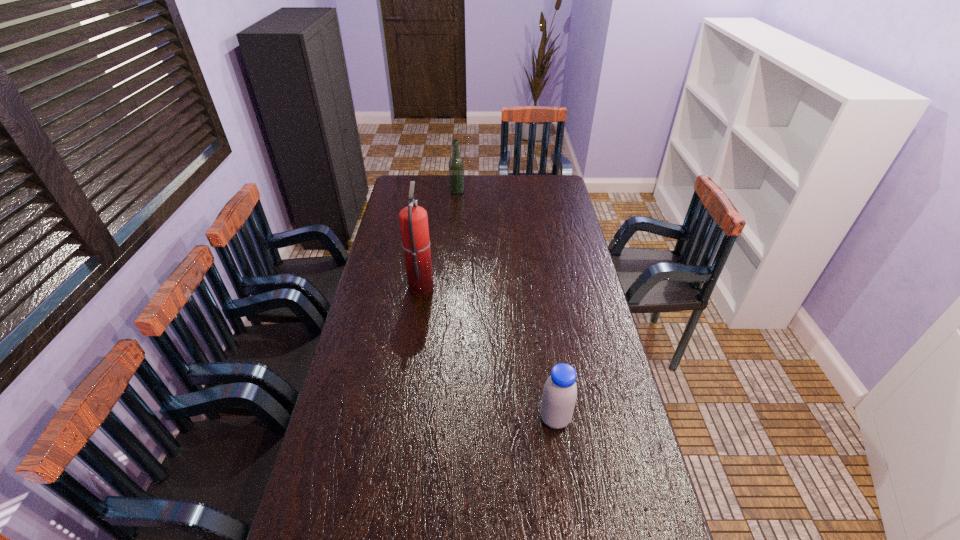
At what (x,y) coordinates should I click in order to perform the action: click on the second farthest object. Please return your answer as a coordinate pair (x, y). The width and height of the screenshot is (960, 540). Looking at the image, I should click on tap(413, 219).

Where is `the tallest object`? Image resolution: width=960 pixels, height=540 pixels. the tallest object is located at coordinates (413, 219).

Find the location of `the farthest object`. the farthest object is located at coordinates (456, 167).

Locate an element on the screen. Image resolution: width=960 pixels, height=540 pixels. liquor is located at coordinates (456, 167).

Where is `soya milk`? soya milk is located at coordinates (559, 396).

Locate an element on the screen. This screenshot has height=540, width=960. the rightmost object is located at coordinates (559, 396).

Image resolution: width=960 pixels, height=540 pixels. Identify the location of vacant region located 0.330m with the nozzle and gauge on the leftmost object. (516, 285).

This screenshot has width=960, height=540. What are the coordinates of `vacant space located on the front of the second object from right to left` in the screenshot? It's located at (456, 204).

Where is `free space located 0.170m on the left of the nearest object`? Image resolution: width=960 pixels, height=540 pixels. free space located 0.170m on the left of the nearest object is located at coordinates (483, 418).

Locate an element on the screen. This screenshot has height=540, width=960. object that is positioned at the far edge is located at coordinates (456, 167).